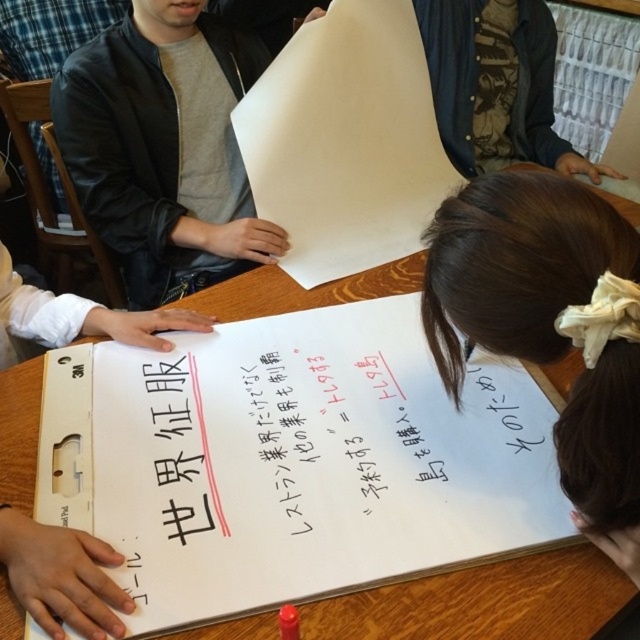
Question: Can you confirm if white paper at center is positioned to the right of white paperboard at center?

Choices:
 (A) no
 (B) yes

Answer: (B)

Question: Observing the image, what is the correct spatial positioning of matte black jacket at upper left in reference to white paperboard at center?

Choices:
 (A) below
 (B) above

Answer: (B)

Question: Which point is farther to the camera?

Choices:
 (A) white paperboard at center
 (B) white paper at lower right
 (C) white paper at center
 (D) matte black jacket at upper left

Answer: (D)

Question: Observing the image, what is the correct spatial positioning of white paper at center in reference to white paperboard at center?

Choices:
 (A) left
 (B) right

Answer: (B)

Question: Which point is closer to the camera?

Choices:
 (A) (333, 177)
 (B) (160, 236)

Answer: (B)

Question: Among these objects, which one is farthest from the camera?

Choices:
 (A) white paper at lower right
 (B) white paperboard at center
 (C) white paper at center

Answer: (C)